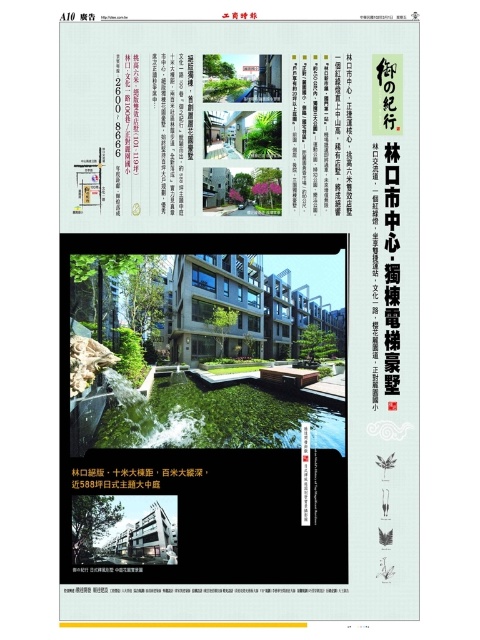
From the picture: Between black paper at upper left and white paper at upper center, which one appears on the right side from the viewer's perspective?

From the viewer's perspective, white paper at upper center appears more on the right side.

Between black paper at upper left and white paper at upper center, which one is positioned higher?

black paper at upper left is above.

Between point (172, 65) and point (303, 156), which one is positioned in front?

Point (172, 65) is more forward.

Image resolution: width=480 pixels, height=640 pixels. Identify the location of black paper at upper left. (156, 125).